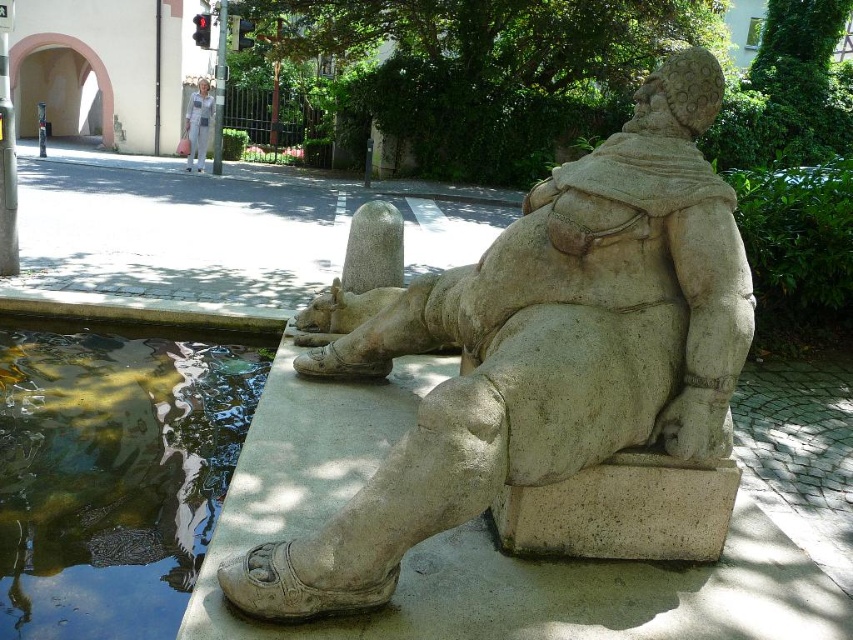
You are an artist planning to create a miniature version of the scene. If you want the white fabric pants at center to be proportional to the stone statue at center in your model, which object should you scale down more when creating the miniature?

The stone statue at center is bigger than white fabric pants at center, so you should scale down the stone statue at center more than the white fabric pants at center to maintain proportion.

You are standing in front of the sculpture and want to place a small flower pot between the stone statue at center and the white fabric pants at center. Based on their positions, which object should the flower pot be closer to?

The stone statue at center is to the right of white fabric pants at center, so the flower pot should be placed closer to the white fabric pants at center to be between them.

You are standing at point (543, 349) in the image. What object are you directly in front of?

You are directly in front of the stone statue at center located at point (543, 349).